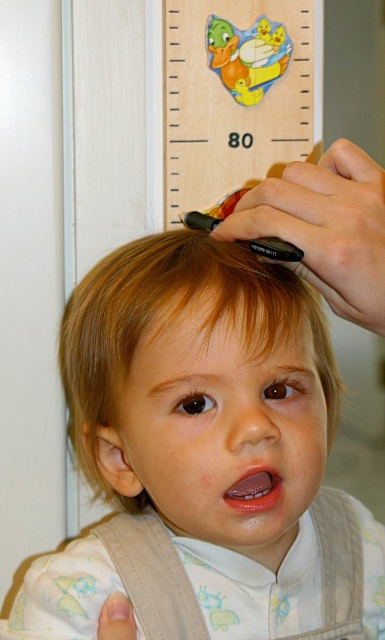
The scene shows a child with light brown hair at center and a wooden ruler at upper center. From the perspective of someone looking at the image, which object is closer to the viewer?

The light brown hair at center is closer to the viewer than the wooden ruler at upper center.

Based on the scene, can you determine which object is larger in size between the light brown hair at center and the wooden ruler at upper center?

The light brown hair at center is bigger than the wooden ruler at upper center according to the description.